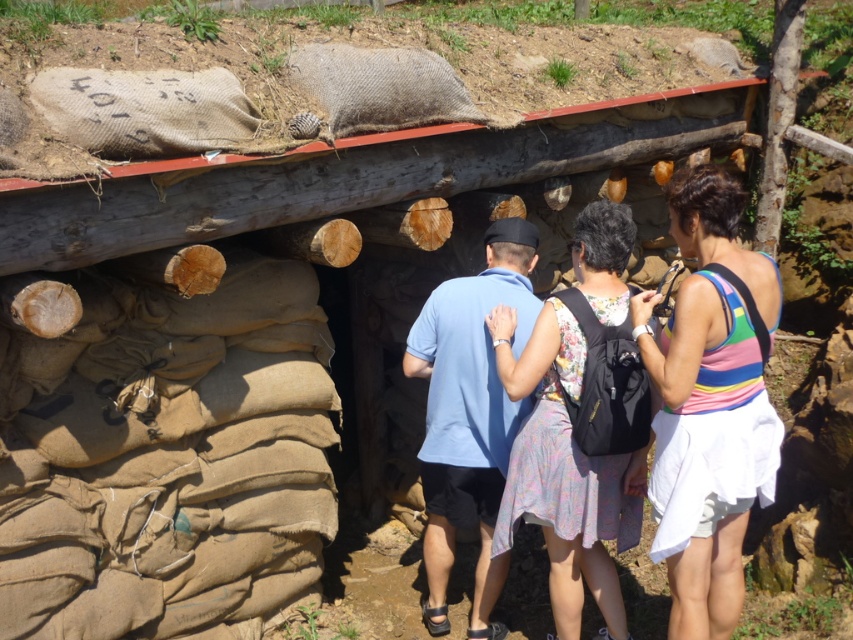
Question: Is floral fabric dress at center further to the viewer compared to blue cotton shirt at center?

Choices:
 (A) no
 (B) yes

Answer: (A)

Question: Which object is farther from the camera taking this photo?

Choices:
 (A) floral fabric dress at center
 (B) blue cotton shirt at center

Answer: (B)

Question: Does floral fabric dress at center come behind blue cotton shirt at center?

Choices:
 (A) yes
 (B) no

Answer: (B)

Question: Among these points, which one is farthest from the camera?

Choices:
 (A) (726, 232)
 (B) (624, 227)

Answer: (B)

Question: Which point appears farthest from the camera in this image?

Choices:
 (A) (614, 300)
 (B) (471, 420)
 (C) (721, 285)

Answer: (B)

Question: Can you confirm if rainbow striped tank top at center is wider than floral fabric dress at center?

Choices:
 (A) yes
 (B) no

Answer: (B)